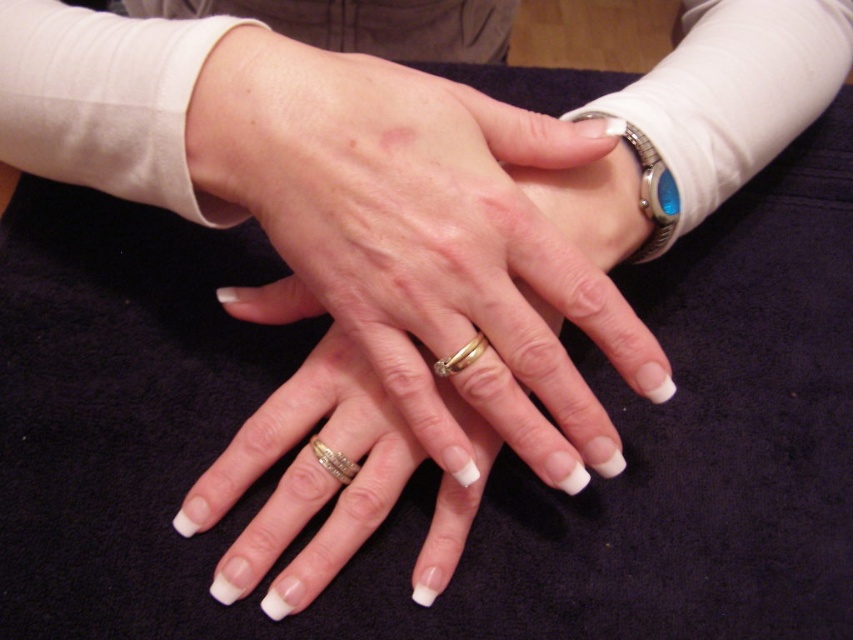
Does point (621, 132) come in front of point (335, 470)?

No, (621, 132) is behind (335, 470).

Who is positioned more to the right, metallic silver watch at upper right or gold textured band at center?

metallic silver watch at upper right

At what (x,y) coordinates should I click in order to perform the action: click on metallic silver watch at upper right. Please return your answer as a coordinate pair (x, y). Image resolution: width=853 pixels, height=640 pixels. Looking at the image, I should click on (653, 193).

What do you see at coordinates (334, 461) in the screenshot? Image resolution: width=853 pixels, height=640 pixels. I see `gold textured band at center` at bounding box center [334, 461].

Is the position of gold textured band at center less distant than that of gold shiny band at center?

No, gold textured band at center is further to the viewer.

Who is more distant from viewer, (x=334, y=468) or (x=457, y=362)?

Positioned behind is point (x=334, y=468).

Find the location of a particular element. The width and height of the screenshot is (853, 640). gold textured band at center is located at coordinates (334, 461).

Between metallic silver watch at upper right and gold shiny band at center, which one is positioned higher?

metallic silver watch at upper right

Which is in front, point (666, 172) or point (451, 355)?

Positioned in front is point (451, 355).

What do you see at coordinates (653, 193) in the screenshot? I see `metallic silver watch at upper right` at bounding box center [653, 193].

Locate an element on the screen. This screenshot has height=640, width=853. metallic silver watch at upper right is located at coordinates (653, 193).